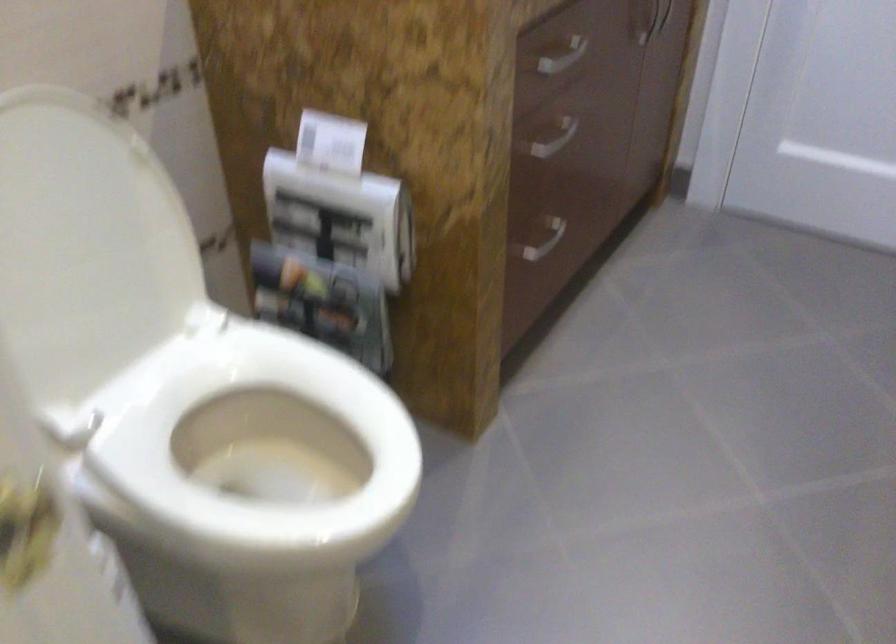
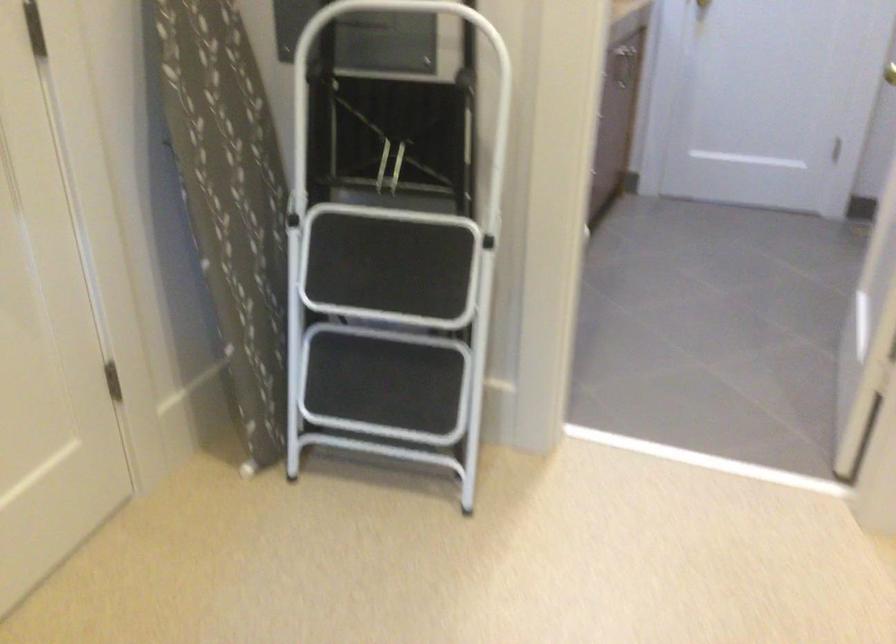
Question: I am providing you with two images of the same scene from different viewpoints. Which of the following objects are not visible in image2?

Choices:
 (A) large glass mug
 (B) white stool handle
 (C) gold door handle
 (D) toilet paper roll

Answer: (D)